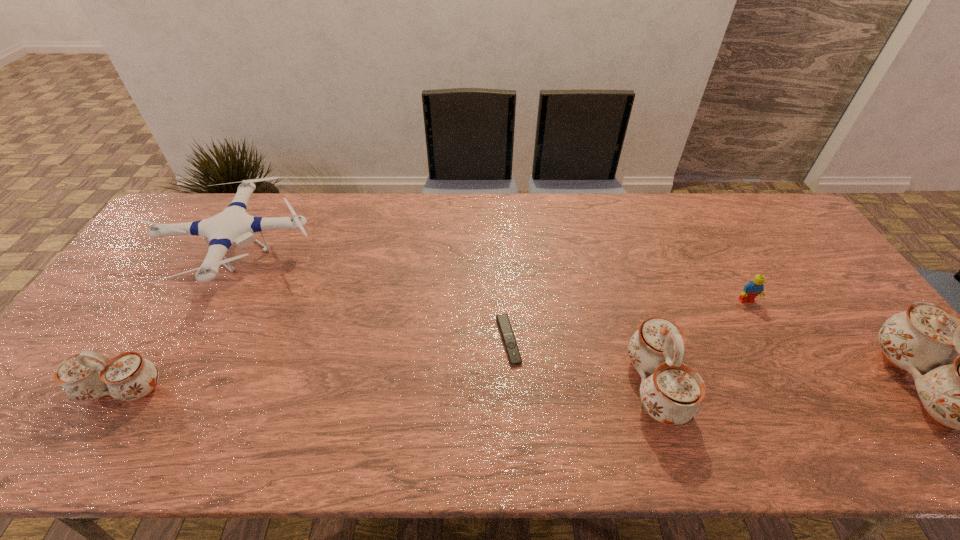
You are a GUI agent. You are given a task and a screenshot of the screen. Output one action in this format:
    pyautogui.click(x=<x>, y=<y>)
    Task: Click on the leftmost chinaware
    
    Given the screenshot: What is the action you would take?
    pyautogui.click(x=88, y=375)

Locate an element on the screen. This screenshot has width=960, height=540. the second shortest chinaware is located at coordinates (672, 394).

This screenshot has height=540, width=960. Find the location of `the second chinaware from left to right`. the second chinaware from left to right is located at coordinates (672, 394).

Identify the location of the second object from right to left. The width and height of the screenshot is (960, 540). (753, 288).

Where is `Lego`? The width and height of the screenshot is (960, 540). Lego is located at coordinates (753, 288).

This screenshot has width=960, height=540. I want to click on drone, so click(x=233, y=225).

In order to click on the third object from left to right in this screenshot , I will do `click(512, 350)`.

You are a GUI agent. You are given a task and a screenshot of the screen. Output one action in this format:
    pyautogui.click(x=<x>, y=<y>)
    Task: Click on the remote control
    The height and width of the screenshot is (540, 960).
    Given the screenshot: What is the action you would take?
    pyautogui.click(x=512, y=350)

This screenshot has width=960, height=540. Identify the location of vacant region located by the handle of the fifth shortest object. (723, 387).

Identify the location of vacant space situated on the face of the Lego. This screenshot has height=540, width=960. (780, 362).